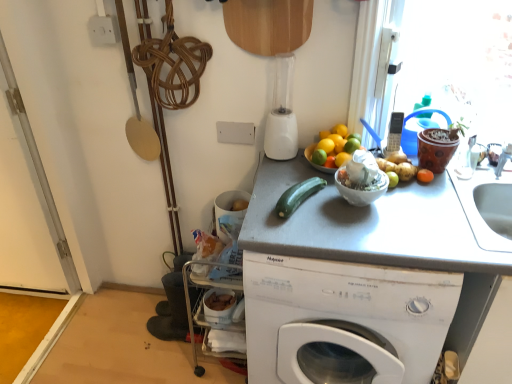
I want to click on free space in front of white glossy bowl at center, so click(x=373, y=235).